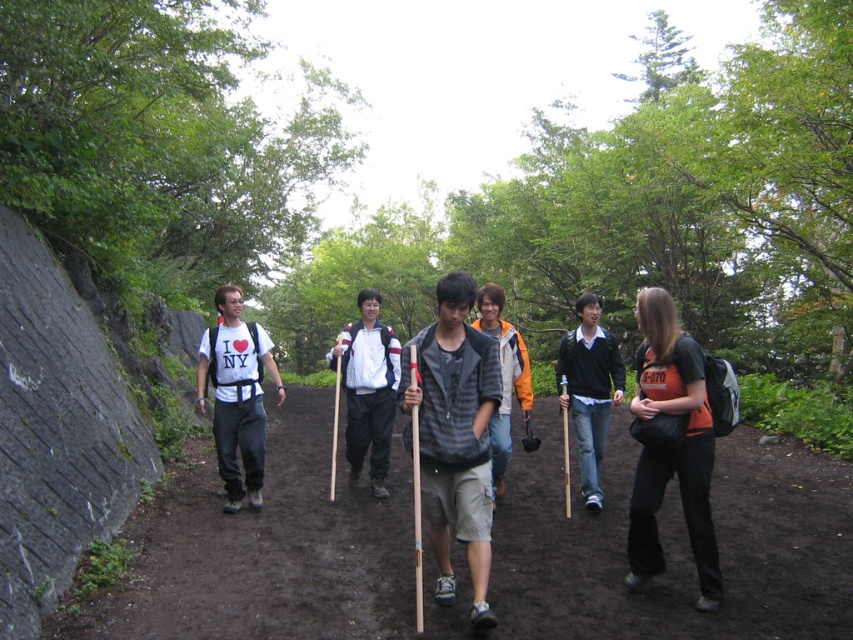
Question: Among these objects, which one is nearest to the camera?

Choices:
 (A) white matte jacket at center
 (B) orange fabric shirt at right
 (C) gray fabric shirt at center
 (D) white matte t-shirt at center

Answer: (C)

Question: Is orange fabric shirt at right above white matte t-shirt at center?

Choices:
 (A) no
 (B) yes

Answer: (A)

Question: Is brown dirt path at center bigger than white matte jacket at center?

Choices:
 (A) no
 (B) yes

Answer: (B)

Question: Considering the relative positions of orange fabric shirt at right and white matte jacket at center in the image provided, where is orange fabric shirt at right located with respect to white matte jacket at center?

Choices:
 (A) above
 (B) below

Answer: (A)

Question: Which object is closer to the camera taking this photo?

Choices:
 (A) gray fabric shirt at center
 (B) brown dirt path at center

Answer: (B)

Question: Considering the real-world distances, which object is farthest from the gray fabric shirt at center?

Choices:
 (A) white matte t-shirt at center
 (B) white matte jacket at center
 (C) brown dirt path at center
 (D) orange fabric shirt at right

Answer: (A)